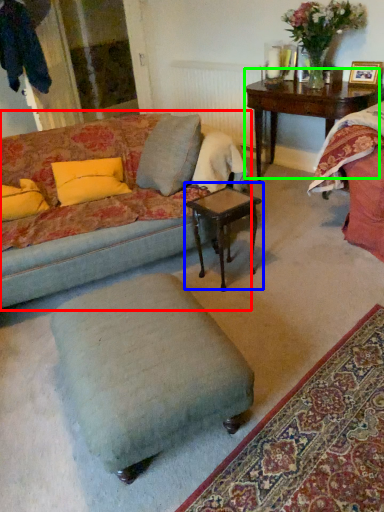
Question: Which object is the closest to the studio couch (highlighted by a red box)? Choose among these: coffee table (highlighted by a blue box) or table (highlighted by a green box).

Choices:
 (A) coffee table
 (B) table

Answer: (A)